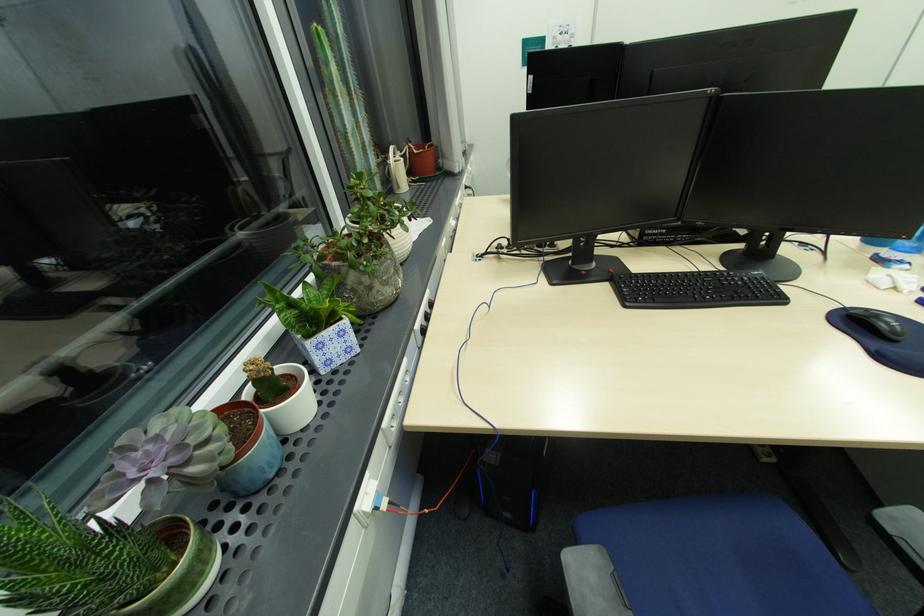
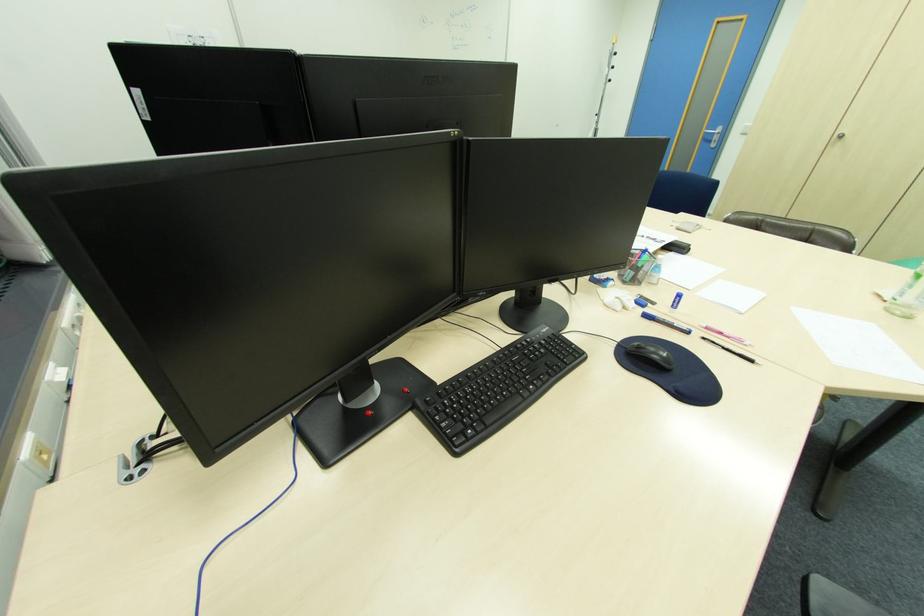
Question: The camera is either moving clockwise (left) or counter-clockwise (right) around the object. The first image is from the beginning of the video and the second image is from the end. Is the camera moving left or right when shooting the video?

Choices:
 (A) Left
 (B) Right

Answer: (A)